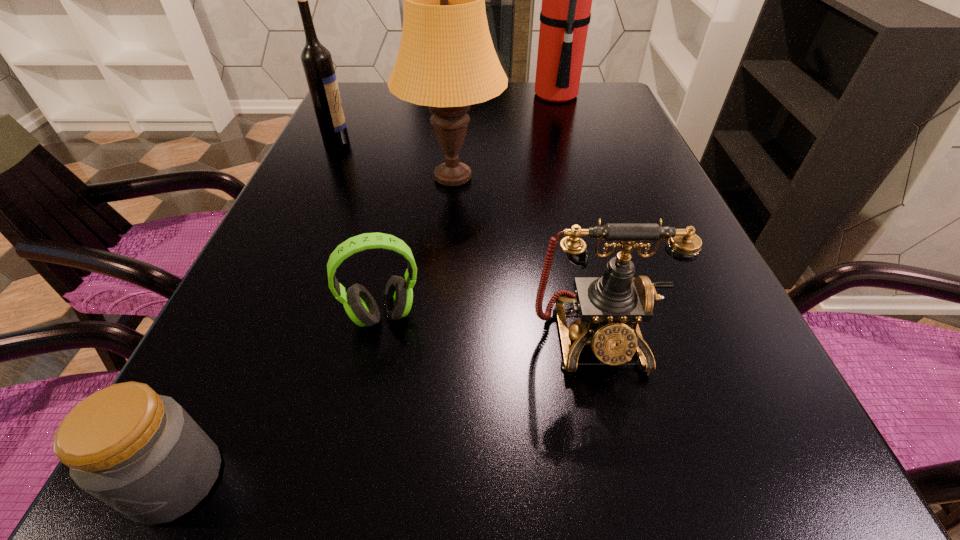
At what (x,y) coordinates should I click in order to perform the action: click on fire extinguisher. Please return your answer as a coordinate pair (x, y). Image resolution: width=960 pixels, height=540 pixels. Looking at the image, I should click on (565, 15).

At what (x,y) coordinates should I click in order to perform the action: click on the tallest object. Please return your answer as a coordinate pair (x, y). Looking at the image, I should click on (565, 15).

Find the location of a particular element. This screenshot has width=960, height=540. the third farthest object is located at coordinates (446, 61).

You are a GUI agent. You are given a task and a screenshot of the screen. Output one action in this format:
    pyautogui.click(x=<x>, y=<y>)
    Task: Click on the fifth nearest object
    Image resolution: width=960 pixels, height=540 pixels.
    Given the screenshot: What is the action you would take?
    pyautogui.click(x=317, y=63)

What are the coordinates of `the third shortest object` in the screenshot? It's located at (610, 307).

Find the location of a particular element. headset is located at coordinates (359, 304).

At what (x,y) coordinates should I click in order to perform the action: click on the nearest object. Please return your answer as a coordinate pair (x, y). This screenshot has width=960, height=540. Looking at the image, I should click on point(141,453).

Where is `free space located at the nozzle of the tallest object`? The image size is (960, 540). free space located at the nozzle of the tallest object is located at coordinates (429, 96).

Where is `free region located at the nozzle of the tallest object`? The height and width of the screenshot is (540, 960). free region located at the nozzle of the tallest object is located at coordinates (405, 96).

Where is `free space located at the nozzle of the tallest object`? Image resolution: width=960 pixels, height=540 pixels. free space located at the nozzle of the tallest object is located at coordinates (402, 96).